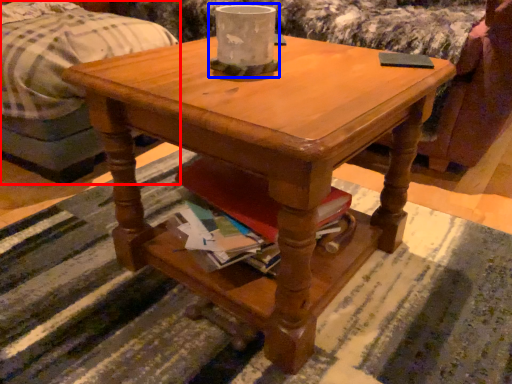
Question: Which point is further to the camera, bed (highlighted by a red box) or candle holder (highlighted by a blue box)?

Choices:
 (A) bed
 (B) candle holder

Answer: (A)